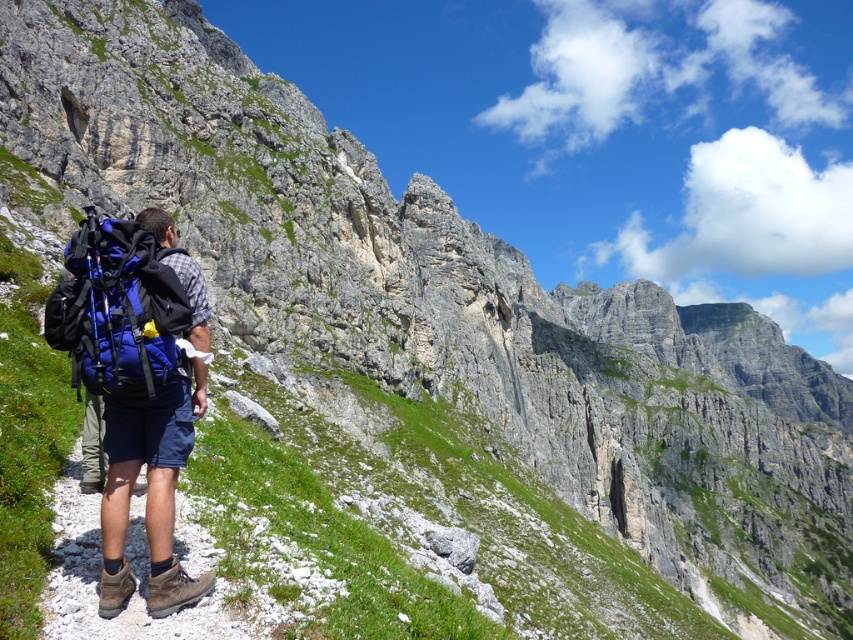
Question: Does blue fabric backpack at left have a greater width compared to blue fabric backpack at center?

Choices:
 (A) no
 (B) yes

Answer: (B)

Question: Which point appears closest to the camera in this image?

Choices:
 (A) (189, 376)
 (B) (119, 394)

Answer: (B)

Question: Does blue fabric backpack at left appear over blue fabric backpack at center?

Choices:
 (A) no
 (B) yes

Answer: (B)

Question: Which point is closer to the camera taking this photo?

Choices:
 (A) (210, 582)
 (B) (186, 308)

Answer: (A)

Question: Among these points, which one is nearest to the camera?

Choices:
 (A) (170, 580)
 (B) (111, 220)

Answer: (A)

Question: Does blue fabric backpack at left have a larger size compared to blue fabric backpack at center?

Choices:
 (A) yes
 (B) no

Answer: (A)